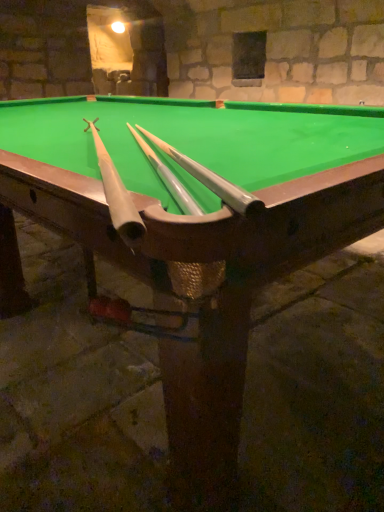
Question: Considering the positions of point (129, 224) and point (238, 192), is point (129, 224) closer or farther from the camera than point (238, 192)?

Choices:
 (A) closer
 (B) farther

Answer: (A)

Question: From the image's perspective, is matte white cue at center, which is counted as the first cue, starting from the left, positioned above or below silver metallic cue at center, which is the 1th cue from right to left?

Choices:
 (A) below
 (B) above

Answer: (A)

Question: Considering the relative positions of matte white cue at center, which is counted as the first cue, starting from the left, and silver metallic cue at center, which is the 1th cue from right to left, in the image provided, is matte white cue at center, which is counted as the first cue, starting from the left, to the left or to the right of silver metallic cue at center, which is the 1th cue from right to left,?

Choices:
 (A) left
 (B) right

Answer: (A)

Question: Is point (163, 140) positioned closer to the camera than point (129, 208)?

Choices:
 (A) farther
 (B) closer

Answer: (A)

Question: Is silver metallic cue at center, which is the 1th cue from right to left, wider or thinner than matte white cue at center, the second cue viewed from the right?

Choices:
 (A) thin
 (B) wide

Answer: (A)

Question: Considering the positions of silver metallic cue at center, which is counted as the second cue, starting from the left, and matte white cue at center, which is counted as the first cue, starting from the left, in the image, is silver metallic cue at center, which is counted as the second cue, starting from the left, bigger or smaller than matte white cue at center, which is counted as the first cue, starting from the left,?

Choices:
 (A) big
 (B) small

Answer: (B)

Question: Is silver metallic cue at center, which is counted as the second cue, starting from the left, to the left or to the right of matte white cue at center, which is counted as the first cue, starting from the left, in the image?

Choices:
 (A) left
 (B) right

Answer: (B)